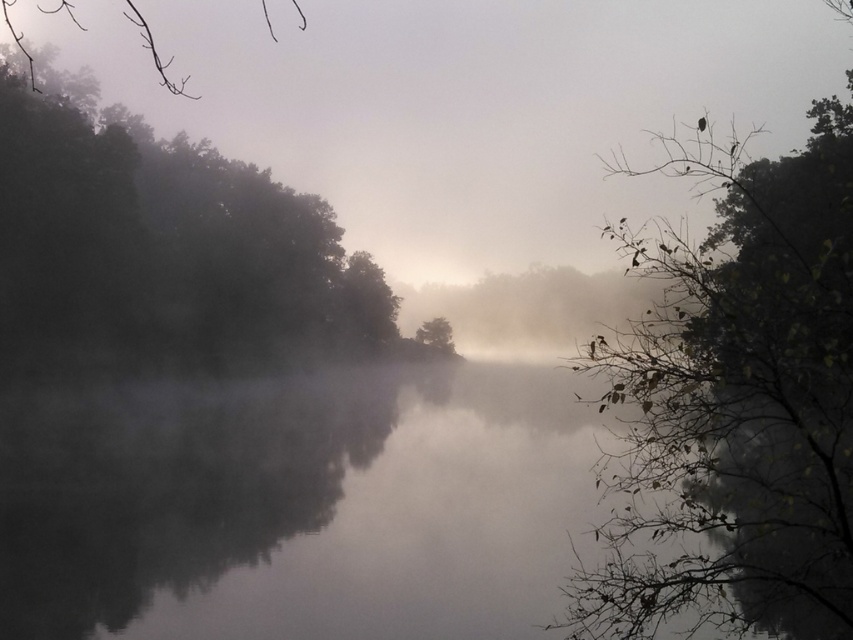
Question: Can you confirm if dark green leafy tree at left is smaller than green matte tree at center?

Choices:
 (A) no
 (B) yes

Answer: (A)

Question: Which object is farther from the camera taking this photo?

Choices:
 (A) green leafy branches at upper right
 (B) foggy water at center
 (C) green matte tree at center

Answer: (C)

Question: Considering the relative positions of dark green leafy tree at left and green matte tree at center in the image provided, where is dark green leafy tree at left located with respect to green matte tree at center?

Choices:
 (A) below
 (B) above

Answer: (B)

Question: In this image, where is dark green leafy tree at left located relative to green matte tree at center?

Choices:
 (A) right
 (B) left

Answer: (B)

Question: Which point appears closest to the camera in this image?

Choices:
 (A) (788, 451)
 (B) (430, 348)
 (C) (540, 465)
 (D) (55, 218)

Answer: (A)

Question: Estimate the real-world distances between objects in this image. Which object is farther from the green leafy branches at upper right?

Choices:
 (A) foggy water at center
 (B) green matte tree at center

Answer: (B)